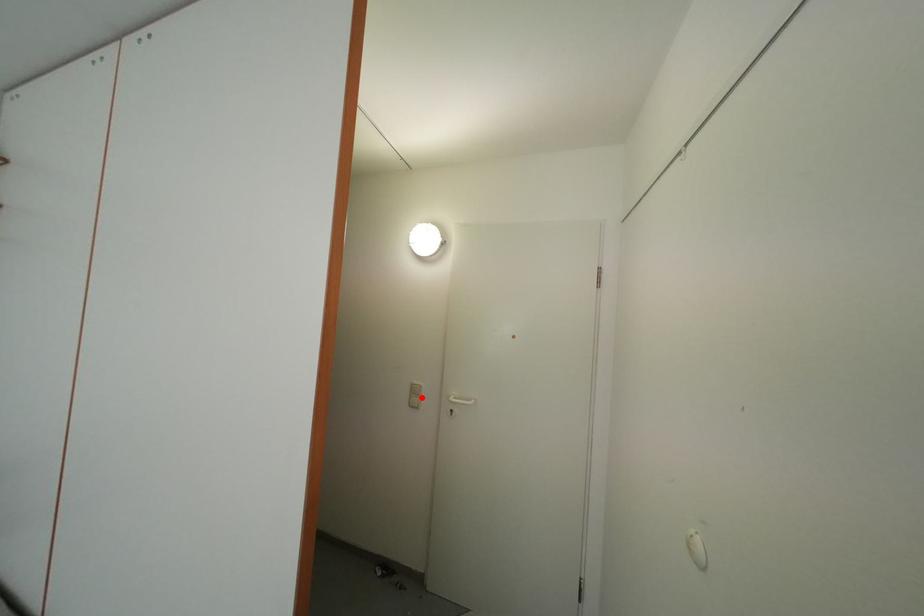
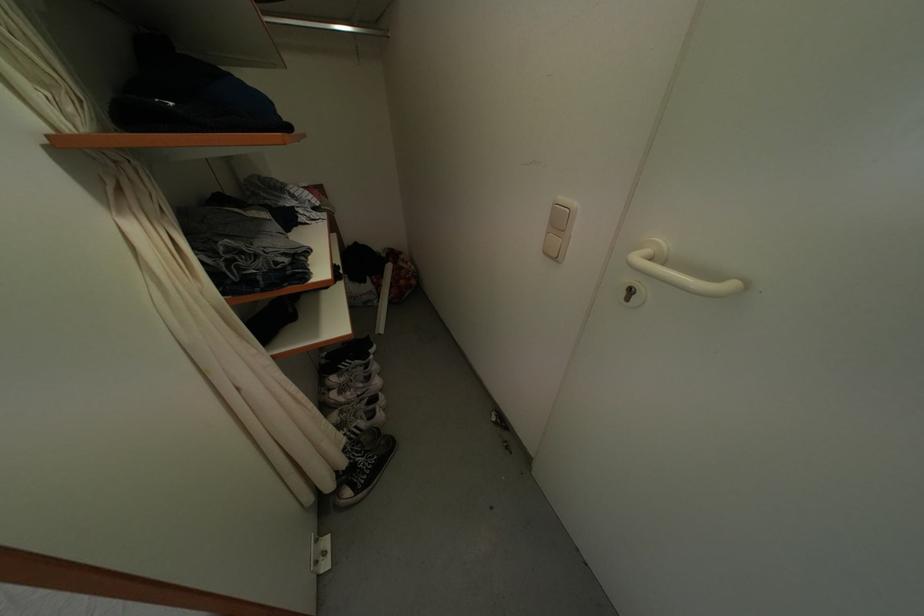
The point at the highlighted location is marked in the first image. Where is the corresponding point in the second image?

(565, 228)